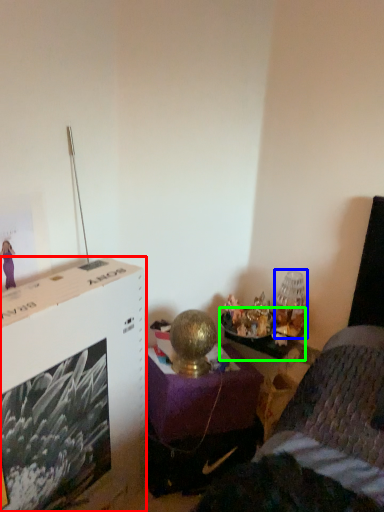
Question: Which object is the closest to the file cabinet (highlighted by a red box)? Choose among these: table lamp (highlighted by a blue box) or table (highlighted by a green box).

Choices:
 (A) table lamp
 (B) table

Answer: (B)